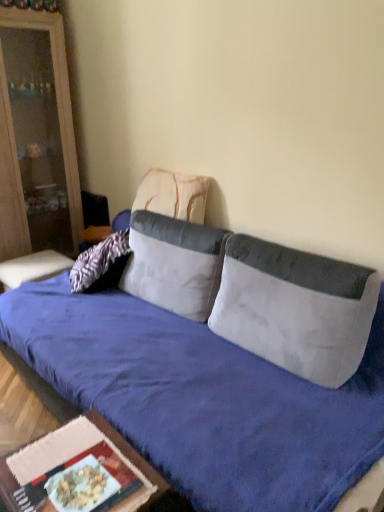
Describe the element at coordinates (174, 264) in the screenshot. Image resolution: width=384 pixels, height=512 pixels. I see `white fabric pillow at center, arranged as the second pillow when viewed from the back` at that location.

The height and width of the screenshot is (512, 384). Find the location of `matte wood cabinet at left`. matte wood cabinet at left is located at coordinates click(x=36, y=136).

Describe the element at coordinates (173, 195) in the screenshot. The width and height of the screenshot is (384, 512). I see `textured beige pillow at center, marked as the first pillow in a back-to-front arrangement` at that location.

The width and height of the screenshot is (384, 512). What do you see at coordinates (129, 453) in the screenshot?
I see `wooden table at lower left` at bounding box center [129, 453].

Find the location of `white fabric pillow at center, arranged as the second pillow when viewed from the back`. white fabric pillow at center, arranged as the second pillow when viewed from the back is located at coordinates point(174,264).

Is white fabric pillow at center, positioned as the 3th pillow in back-to-front order, inside textured beige pillow at center, the third pillow positioned from the front?

Definitely not — white fabric pillow at center, positioned as the 3th pillow in back-to-front order, is not inside textured beige pillow at center, the third pillow positioned from the front.

Can you confirm if textured beige pillow at center, marked as the first pillow in a back-to-front arrangement, is wider than white fabric pillow at center, positioned as the 3th pillow in back-to-front order?

No.

Does point (163, 207) lie behind point (226, 308)?

Yes, point (163, 207) is behind point (226, 308).

Which is more to the left, textured beige pillow at center, marked as the first pillow in a back-to-front arrangement, or white fabric pillow at center, positioned as the 3th pillow in back-to-front order?

From the viewer's perspective, textured beige pillow at center, marked as the first pillow in a back-to-front arrangement, appears more on the left side.

Considering the sizes of objects velvet blue studio couch at center and textured beige pillow at center, marked as the first pillow in a back-to-front arrangement, in the image provided, who is shorter, velvet blue studio couch at center or textured beige pillow at center, marked as the first pillow in a back-to-front arrangement,?

Standing shorter between the two is textured beige pillow at center, marked as the first pillow in a back-to-front arrangement.

From the image's perspective, which one is positioned lower, velvet blue studio couch at center or textured beige pillow at center, marked as the first pillow in a back-to-front arrangement?

velvet blue studio couch at center, from the image's perspective.

Is the position of velvet blue studio couch at center less distant than that of textured beige pillow at center, marked as the first pillow in a back-to-front arrangement?

Yes.

From the image's perspective, is wooden table at lower left located beneath velvet blue studio couch at center?

Indeed, from the image's perspective, wooden table at lower left is shown beneath velvet blue studio couch at center.

In the image, is wooden table at lower left positioned in front of or behind velvet blue studio couch at center?

Clearly, wooden table at lower left is behind velvet blue studio couch at center.

Where is `table behind the velvet blue studio couch at center`? table behind the velvet blue studio couch at center is located at coordinates (129, 453).

From a real-world perspective, which is physically below, wooden table at lower left or velvet blue studio couch at center?

wooden table at lower left is physically lower.

The height and width of the screenshot is (512, 384). I want to click on studio couch that appears below the matte wood cabinet at left (from the image's perspective), so click(x=202, y=399).

Is matte wood cabinet at left taller than velvet blue studio couch at center?

Correct, matte wood cabinet at left is much taller as velvet blue studio couch at center.

From the image's perspective, is matte wood cabinet at left on top of velvet blue studio couch at center?

Correct, matte wood cabinet at left appears higher than velvet blue studio couch at center in the image.

How different are the orientations of matte wood cabinet at left and velvet blue studio couch at center in degrees?

The angle between the facing direction of matte wood cabinet at left and the facing direction of velvet blue studio couch at center is 91.5 degrees.

Where is `the 2nd pillow to the left when counting from the velvet blue studio couch at center`? the 2nd pillow to the left when counting from the velvet blue studio couch at center is located at coordinates (173, 195).

Between textured beige pillow at center, the third pillow positioned from the front, and velvet blue studio couch at center, which one has more height?

velvet blue studio couch at center is taller.

Is textured beige pillow at center, the third pillow positioned from the front, in contact with velvet blue studio couch at center?

textured beige pillow at center, the third pillow positioned from the front, and velvet blue studio couch at center are clearly separated.

Can you tell me how much velvet blue studio couch at center and matte wood cabinet at left differ in facing direction?

91.5 degrees.

The image size is (384, 512). Identify the location of cabinetry lying behind the velvet blue studio couch at center. (36, 136).

Is velvet blue studio couch at center with matte wood cabinet at left?

velvet blue studio couch at center and matte wood cabinet at left are not in contact.

In the scene shown: Can you confirm if velvet blue studio couch at center is taller than matte wood cabinet at left?

No.

Is white fabric pillow at center, arranged as the second pillow when viewed from the back, in front of matte wood cabinet at left?

Yes, white fabric pillow at center, arranged as the second pillow when viewed from the back, is in front of matte wood cabinet at left.

From a real-world perspective, between white fabric pillow at center, arranged as the second pillow when viewed from the back, and matte wood cabinet at left, who is vertically lower?

In real-world perspective, white fabric pillow at center, arranged as the second pillow when viewed from the back, is lower.

Looking at this image, is white fabric pillow at center, acting as the 2th pillow starting from the front, situated inside matte wood cabinet at left or outside?

white fabric pillow at center, acting as the 2th pillow starting from the front, is spatially situated outside matte wood cabinet at left.

This screenshot has height=512, width=384. Identify the location of the 2nd pillow in front of the textured beige pillow at center, the third pillow positioned from the front, starting your count from the anchor. (295, 308).

The width and height of the screenshot is (384, 512). I want to click on the 3rd pillow above the velvet blue studio couch at center (from the image's perspective), so click(173, 195).

From the image, which object appears to be nearer to white fabric pillow at center, the first pillow in the front-to-back sequence, velvet blue studio couch at center or textured beige pillow at center, the third pillow positioned from the front?

velvet blue studio couch at center is closer to white fabric pillow at center, the first pillow in the front-to-back sequence.

Looking at the image, which one is located further to white fabric pillow at center, acting as the 2th pillow starting from the front, wooden table at lower left or velvet blue studio couch at center?

The object further to white fabric pillow at center, acting as the 2th pillow starting from the front, is wooden table at lower left.

Based on their spatial positions, is textured beige pillow at center, the third pillow positioned from the front, or white fabric pillow at center, the first pillow in the front-to-back sequence, closer to wooden table at lower left?

Among the two, white fabric pillow at center, the first pillow in the front-to-back sequence, is located nearer to wooden table at lower left.

When comparing their distances from white fabric pillow at center, the first pillow in the front-to-back sequence, does wooden table at lower left or textured beige pillow at center, marked as the first pillow in a back-to-front arrangement, seem further?

Based on the image, textured beige pillow at center, marked as the first pillow in a back-to-front arrangement, appears to be further to white fabric pillow at center, the first pillow in the front-to-back sequence.

Looking at the image, which one is located further to matte wood cabinet at left, velvet blue studio couch at center or wooden table at lower left?

wooden table at lower left is further to matte wood cabinet at left.

Looking at the image, which one is located further to textured beige pillow at center, the third pillow positioned from the front, matte wood cabinet at left or velvet blue studio couch at center?

The object further to textured beige pillow at center, the third pillow positioned from the front, is matte wood cabinet at left.

Considering their positions, is white fabric pillow at center, the first pillow in the front-to-back sequence, positioned further to velvet blue studio couch at center than wooden table at lower left?

Among the two, wooden table at lower left is located further to velvet blue studio couch at center.

Which object lies further to the anchor point textured beige pillow at center, the third pillow positioned from the front, velvet blue studio couch at center or wooden table at lower left?

The object further to textured beige pillow at center, the third pillow positioned from the front, is wooden table at lower left.

The image size is (384, 512). I want to click on table positioned between velvet blue studio couch at center and white fabric pillow at center, acting as the 2th pillow starting from the front, from near to far, so click(129, 453).

Where is `pillow positioned between white fabric pillow at center, positioned as the 3th pillow in back-to-front order, and textured beige pillow at center, the third pillow positioned from the front, from near to far`? pillow positioned between white fabric pillow at center, positioned as the 3th pillow in back-to-front order, and textured beige pillow at center, the third pillow positioned from the front, from near to far is located at coordinates (174, 264).

The image size is (384, 512). I want to click on studio couch situated between wooden table at lower left and white fabric pillow at center, positioned as the 3th pillow in back-to-front order, from left to right, so click(202, 399).

Find the location of a particular element. studio couch between matte wood cabinet at left and white fabric pillow at center, positioned as the 3th pillow in back-to-front order is located at coordinates (202, 399).